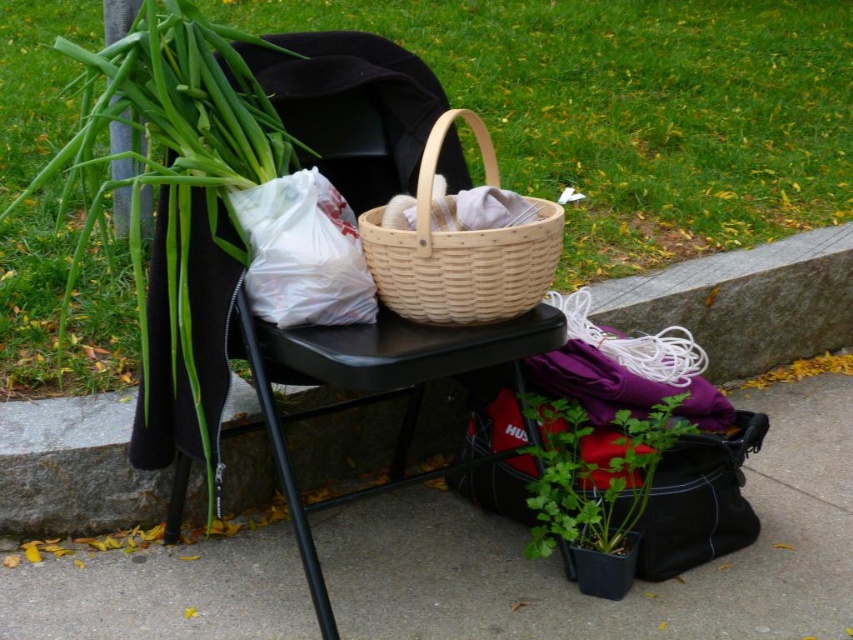
You are standing in the scene and want to take a photo of the green matte pole at upper left without the green grass at upper center blocking it. How should you position yourself?

Move to the side so that the green matte pole at upper left is no longer blocked by the green grass at upper center, since the green matte pole at upper left is behind the green grass at upper center.

You are standing in the outdoor scene and want to determine which object is taller between the green grass at upper center and the green matte pole at upper left. Based on the scene description, which one is taller?

The green grass at upper center is much taller than the green matte pole at upper left according to the description.